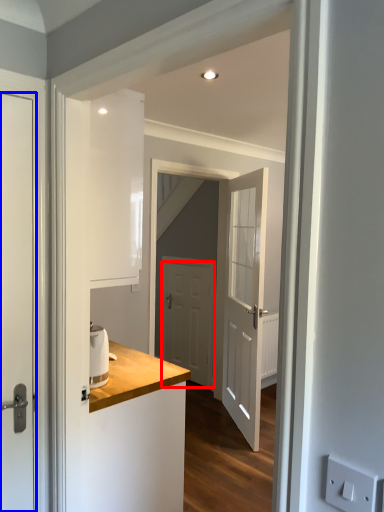
Question: Which point is further to the camera, door (highlighted by a red box) or door (highlighted by a blue box)?

Choices:
 (A) door
 (B) door

Answer: (A)